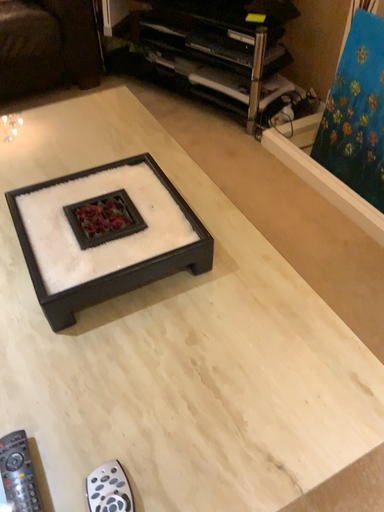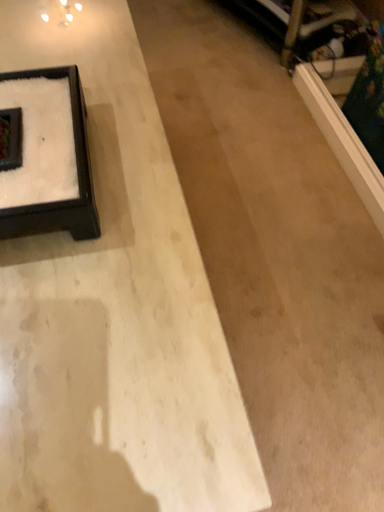
Question: Which way did the camera rotate in the video?

Choices:
 (A) rotated left
 (B) rotated right

Answer: (A)